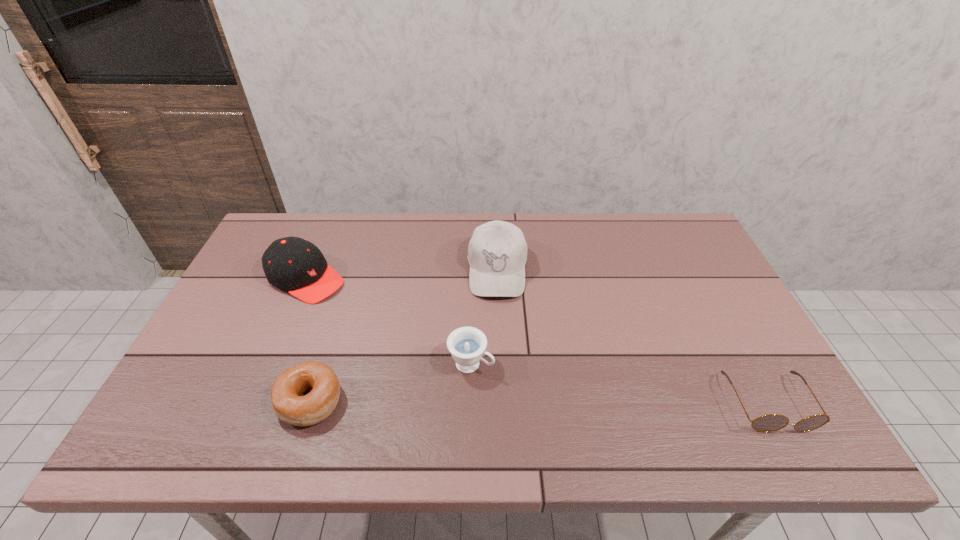
Locate an element on the screen. The height and width of the screenshot is (540, 960). free spot between the cap and the rightmost object is located at coordinates (537, 341).

Where is `the third closest object to the cap`? the third closest object to the cap is located at coordinates (497, 252).

This screenshot has width=960, height=540. In order to click on the second closest object to the sunglasses in this screenshot , I will do `click(466, 344)`.

Where is `vacant space that satisfies the following two spatial constraints: 1. on the back side of the teacup; 2. on the right side of the bagel`? The height and width of the screenshot is (540, 960). vacant space that satisfies the following two spatial constraints: 1. on the back side of the teacup; 2. on the right side of the bagel is located at coordinates (322, 363).

Where is `vacant area in the image that satisfies the following two spatial constraints: 1. on the back side of the bagel; 2. on the right side of the teacup`? This screenshot has height=540, width=960. vacant area in the image that satisfies the following two spatial constraints: 1. on the back side of the bagel; 2. on the right side of the teacup is located at coordinates (322, 363).